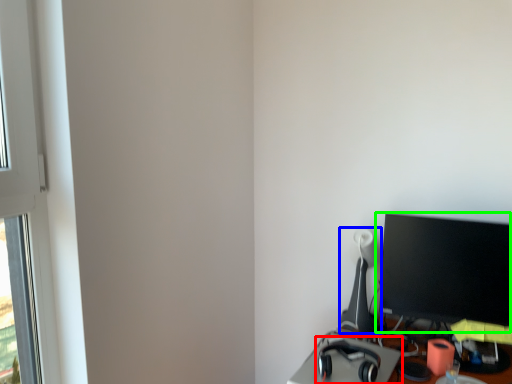
Question: Considering the real-world distances, which object is farthest from headphones (highlighted by a red box)? table lamp (highlighted by a blue box) or computer monitor (highlighted by a green box)?

Choices:
 (A) table lamp
 (B) computer monitor

Answer: (B)